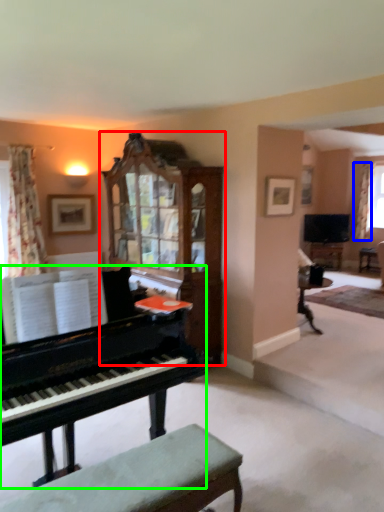
Question: Which object is the closest to the cabinetry (highlighted by a red box)? Choose among these: curtain (highlighted by a blue box) or piano (highlighted by a green box).

Choices:
 (A) curtain
 (B) piano

Answer: (B)